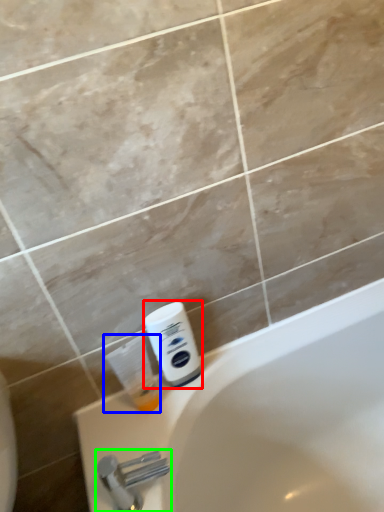
Question: Estimate the real-world distances between objects in this image. Which object is farther from shaving cream (highlighted by a red box), cleaning product (highlighted by a blue box) or tap (highlighted by a green box)?

Choices:
 (A) cleaning product
 (B) tap

Answer: (B)